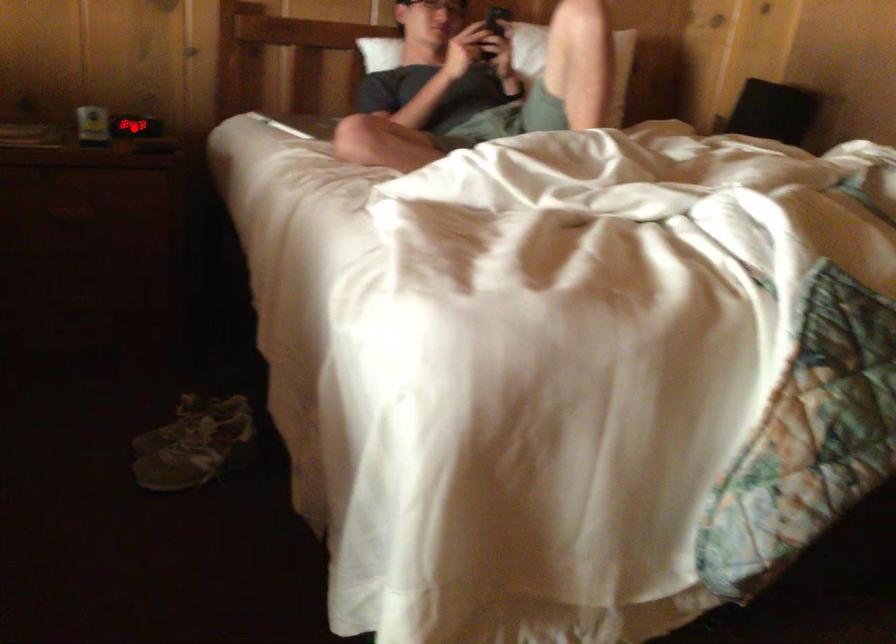
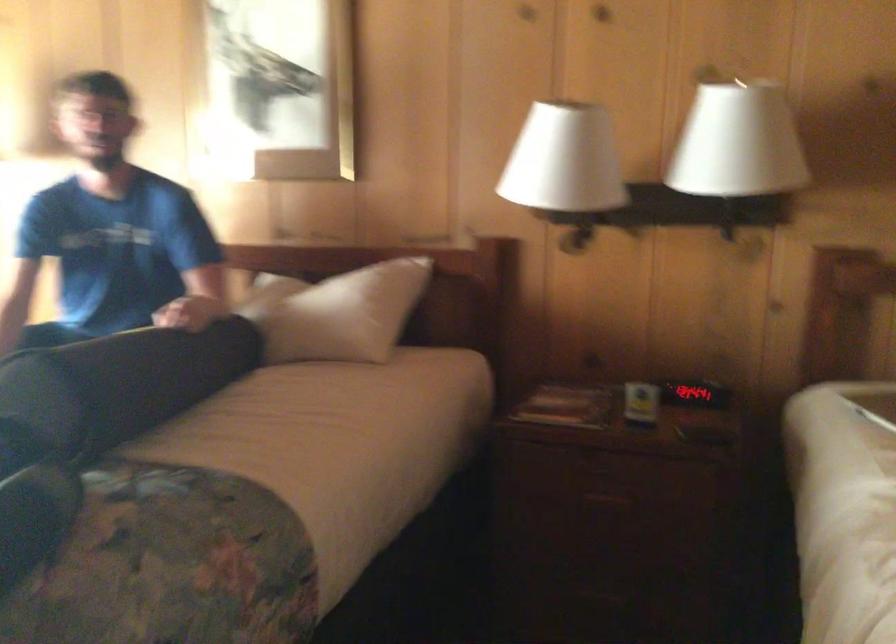
Where in the second image is the point corresponding to the highlighted location from the first image?

(694, 393)